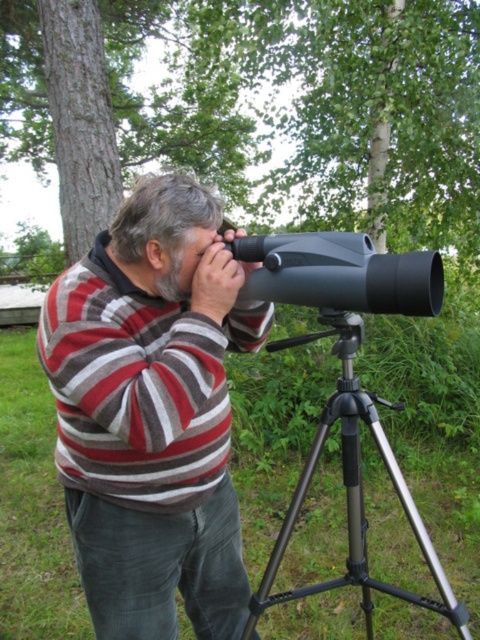
From the picture: Which is more to the right, striped sweater at center or black plastic telescope at center?

Positioned to the right is black plastic telescope at center.

Is striped sweater at center wider than black plastic telescope at center?

Correct, the width of striped sweater at center exceeds that of black plastic telescope at center.

Which is in front, point (181, 317) or point (297, 252)?

Point (181, 317) is more forward.

I want to click on striped sweater at center, so click(x=152, y=413).

Does black metallic tripod at center have a greater height compared to black plastic telescope at center?

Indeed, black metallic tripod at center has a greater height compared to black plastic telescope at center.

Between black metallic tripod at center and black plastic telescope at center, which one appears on the left side from the viewer's perspective?

black plastic telescope at center is more to the left.

Does point (369, 412) come closer to viewer compared to point (347, 250)?

No, it is behind (347, 250).

I want to click on black metallic tripod at center, so click(352, 490).

How distant is striped sweater at center from black metallic tripod at center?

striped sweater at center and black metallic tripod at center are 13.38 inches apart from each other.

Who is taller, striped sweater at center or black metallic tripod at center?

With more height is striped sweater at center.

Is point (207, 410) closer to camera compared to point (347, 352)?

Yes, point (207, 410) is in front of point (347, 352).

Locate an element on the screen. The width and height of the screenshot is (480, 640). striped sweater at center is located at coordinates point(152,413).